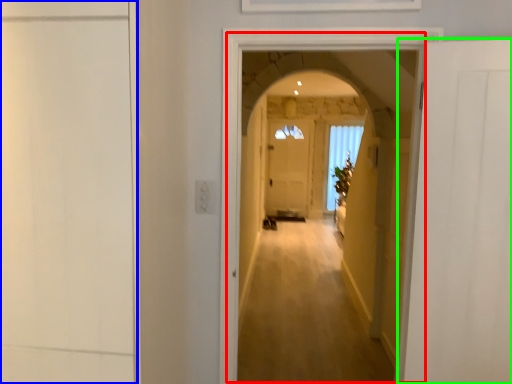
Question: Estimate the real-world distances between objects in this image. Which object is closer to corridor (highlighted by a red box), door (highlighted by a blue box) or door (highlighted by a green box)?

Choices:
 (A) door
 (B) door

Answer: (B)